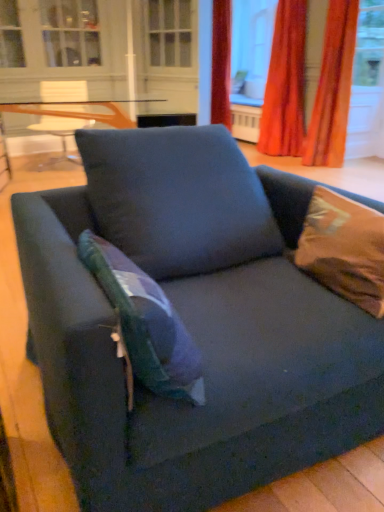
Question: Is brown satin pillow at upper right, which is the 2th pillow in left-to-right order, outside of white glass screen door at upper center?

Choices:
 (A) yes
 (B) no

Answer: (A)

Question: Considering the relative sizes of brown satin pillow at upper right, which is the 2th pillow in left-to-right order, and white glass screen door at upper center in the image provided, is brown satin pillow at upper right, which is the 2th pillow in left-to-right order, wider than white glass screen door at upper center?

Choices:
 (A) yes
 (B) no

Answer: (B)

Question: Can you confirm if brown satin pillow at upper right, which is the 2th pillow in left-to-right order, is bigger than white glass screen door at upper center?

Choices:
 (A) yes
 (B) no

Answer: (B)

Question: Does brown satin pillow at upper right, marked as the 1th pillow in a right-to-left arrangement, have a smaller size compared to white glass screen door at upper center?

Choices:
 (A) no
 (B) yes

Answer: (B)

Question: Is brown satin pillow at upper right, marked as the 1th pillow in a right-to-left arrangement, looking in the opposite direction of white glass screen door at upper center?

Choices:
 (A) no
 (B) yes

Answer: (A)

Question: From the image's perspective, is brown satin pillow at upper right, marked as the 1th pillow in a right-to-left arrangement, beneath white glass screen door at upper center?

Choices:
 (A) yes
 (B) no

Answer: (A)

Question: Is transparent glass window screen at upper center taller than clear glass table at upper center?

Choices:
 (A) yes
 (B) no

Answer: (A)

Question: Is transparent glass window screen at upper center with clear glass table at upper center?

Choices:
 (A) yes
 (B) no

Answer: (B)

Question: From a real-world perspective, is transparent glass window screen at upper center located beneath clear glass table at upper center?

Choices:
 (A) yes
 (B) no

Answer: (B)

Question: Could you tell me if transparent glass window screen at upper center is facing clear glass table at upper center?

Choices:
 (A) no
 (B) yes

Answer: (A)

Question: Would you say transparent glass window screen at upper center contains clear glass table at upper center?

Choices:
 (A) yes
 (B) no

Answer: (B)

Question: Does transparent glass window screen at upper center come behind clear glass table at upper center?

Choices:
 (A) no
 (B) yes

Answer: (B)

Question: Is velvet orange curtain at upper right, which appears as the 2th curtain when viewed from the right, not near teal fabric pillow at center, which is the 2th pillow in right-to-left order?

Choices:
 (A) no
 (B) yes

Answer: (B)